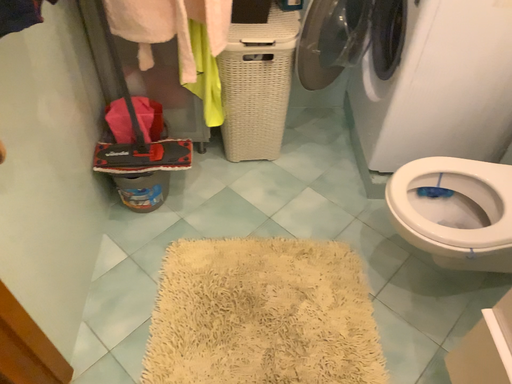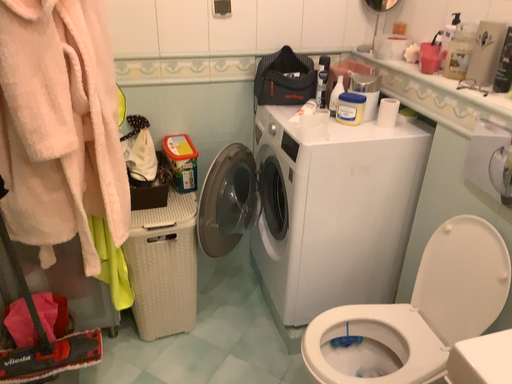
Question: Which way did the camera rotate in the video?

Choices:
 (A) rotated upward
 (B) rotated downward

Answer: (A)